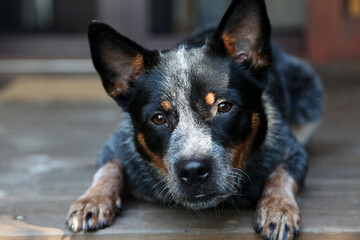
You are a GUI agent. You are given a task and a screenshot of the screen. Output one action in this format:
    pyautogui.click(x=<x>, y=<y>)
    Task: Click on the red wall in background
    This screenshot has width=360, height=240.
    Given the screenshot: What is the action you would take?
    pyautogui.click(x=322, y=34)